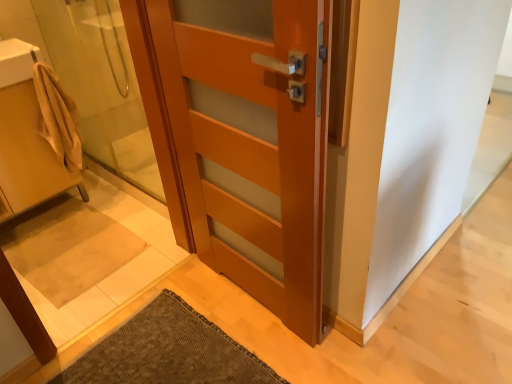
Where is `vacant area to the right of beige fabric towel at left, which ranks as the first sink in bottom-to-top order`? The width and height of the screenshot is (512, 384). vacant area to the right of beige fabric towel at left, which ranks as the first sink in bottom-to-top order is located at coordinates (97, 233).